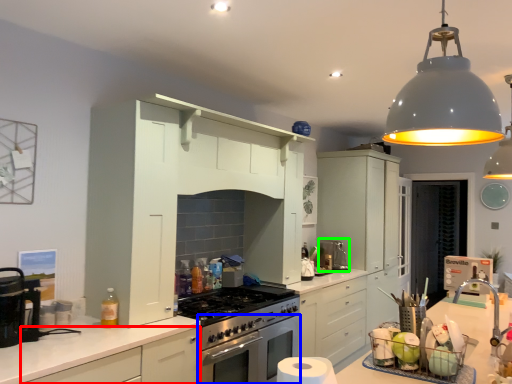
Question: Which object is the farthest from cabinetry (highlighted by a red box)? Choose among these: oven (highlighted by a blue box) or coffee machine (highlighted by a green box).

Choices:
 (A) oven
 (B) coffee machine

Answer: (B)